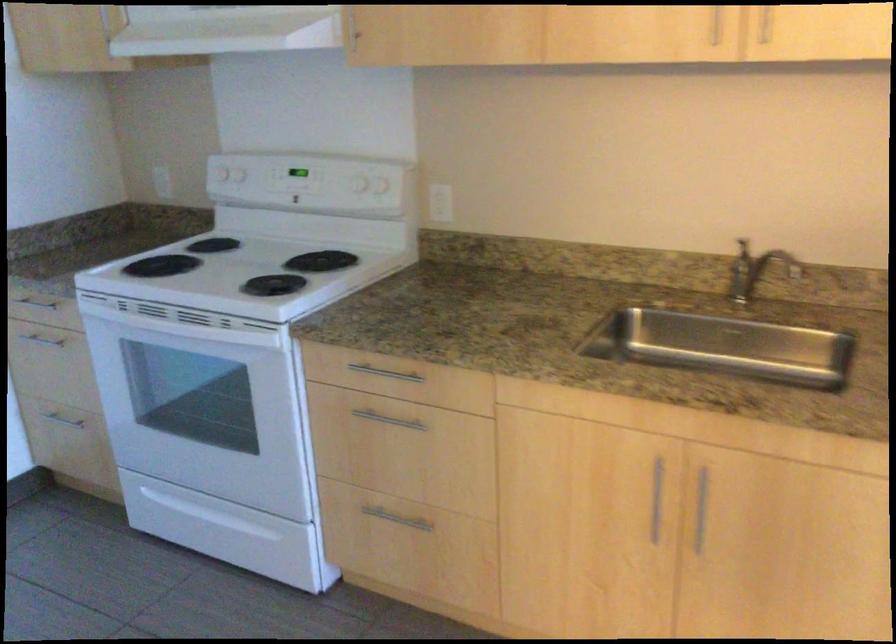
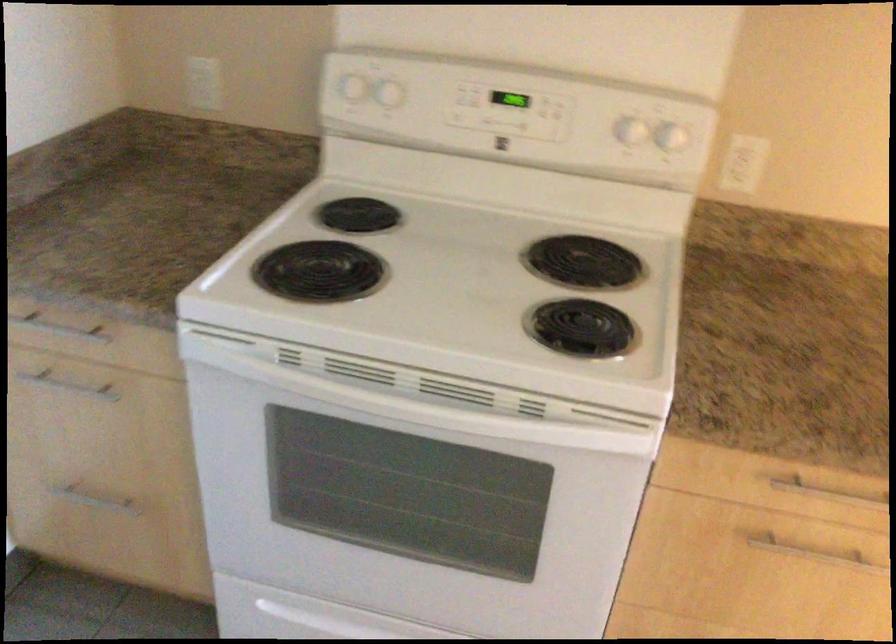
Which direction would the cameraman need to move to produce the second image?

The cameraman walked toward left, forward.